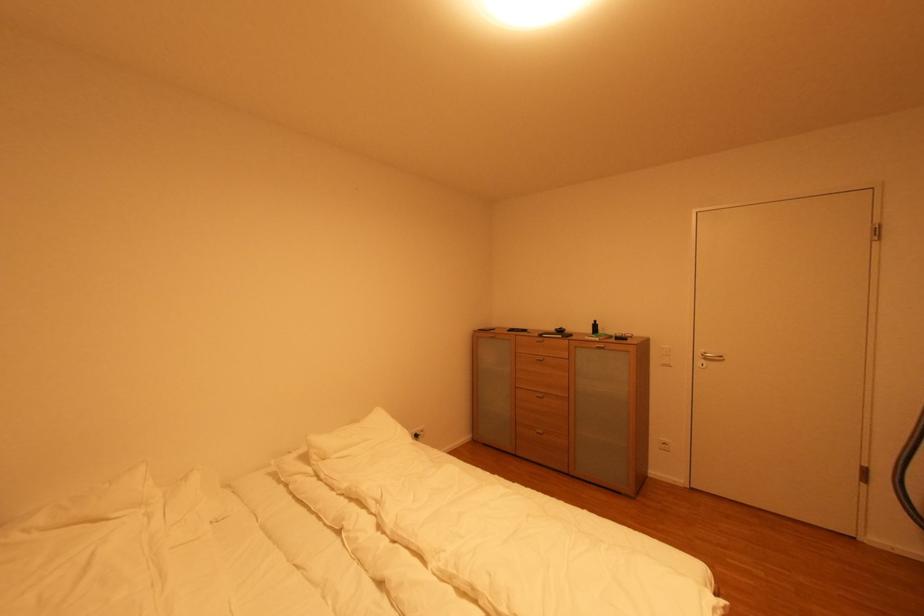
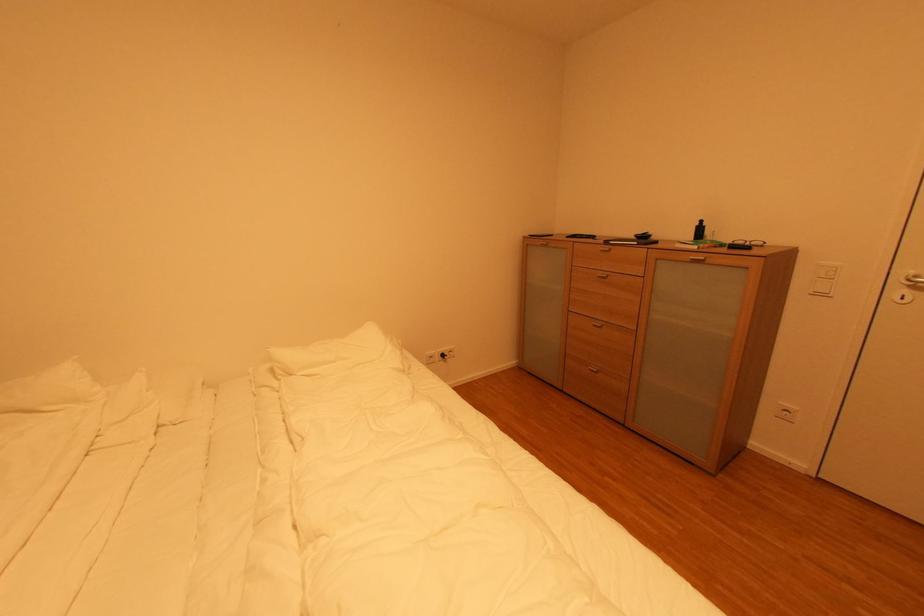
Question: How did the camera likely rotate?

Choices:
 (A) Left
 (B) Right
 (C) Up
 (D) Down

Answer: (A)